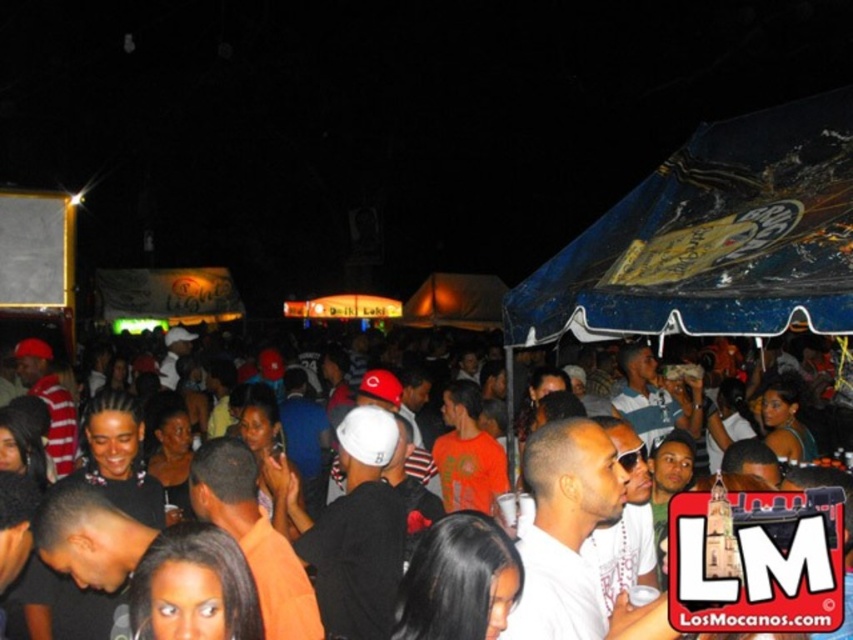
Which is below, blue plastic canopy at upper right or black matte crowd at center?

Positioned lower is black matte crowd at center.

The image size is (853, 640). Find the location of `blue plastic canopy at upper right`. blue plastic canopy at upper right is located at coordinates (x=712, y=237).

Is point (674, 170) positioned after point (294, 531)?

Yes, point (674, 170) is behind point (294, 531).

Identify the location of blue plastic canopy at upper right. Image resolution: width=853 pixels, height=640 pixels. (712, 237).